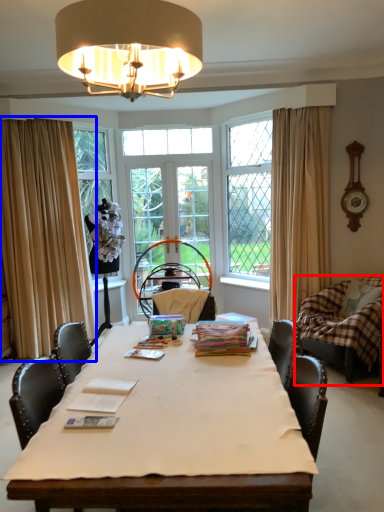
Question: Which point is closer to the camera, swivel chair (highlighted by a red box) or curtain (highlighted by a blue box)?

Choices:
 (A) swivel chair
 (B) curtain

Answer: (A)